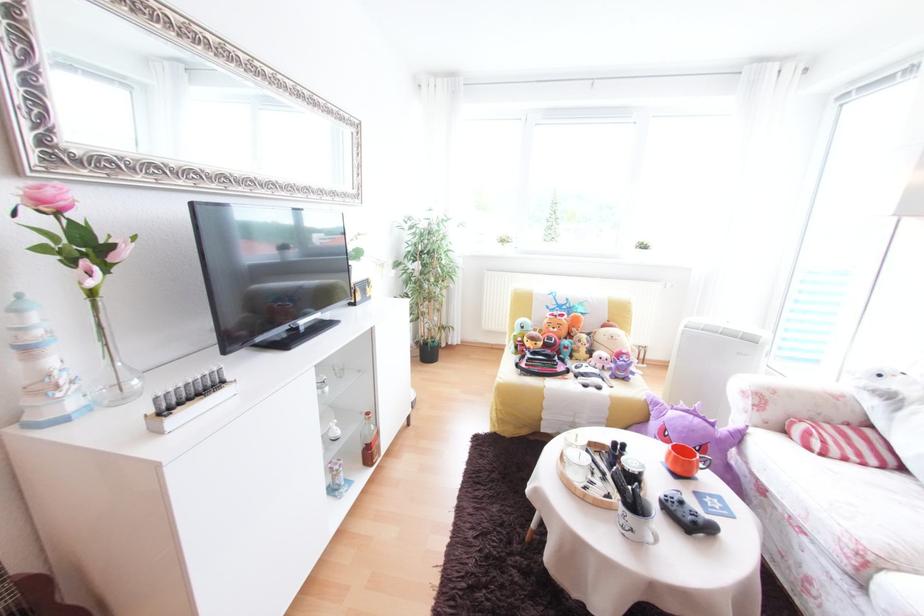
Which object does [505,315] point to?

This point indicates the black makeup brush.